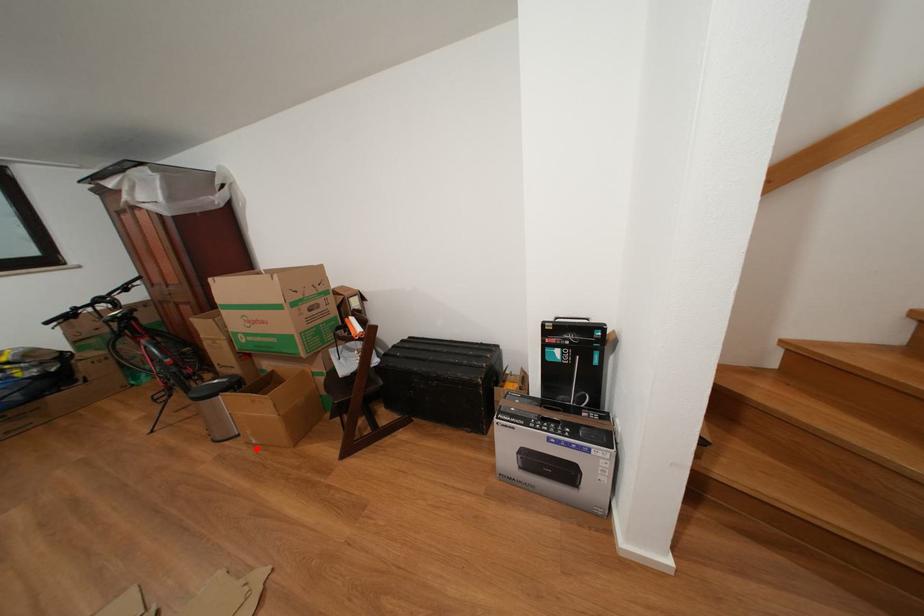
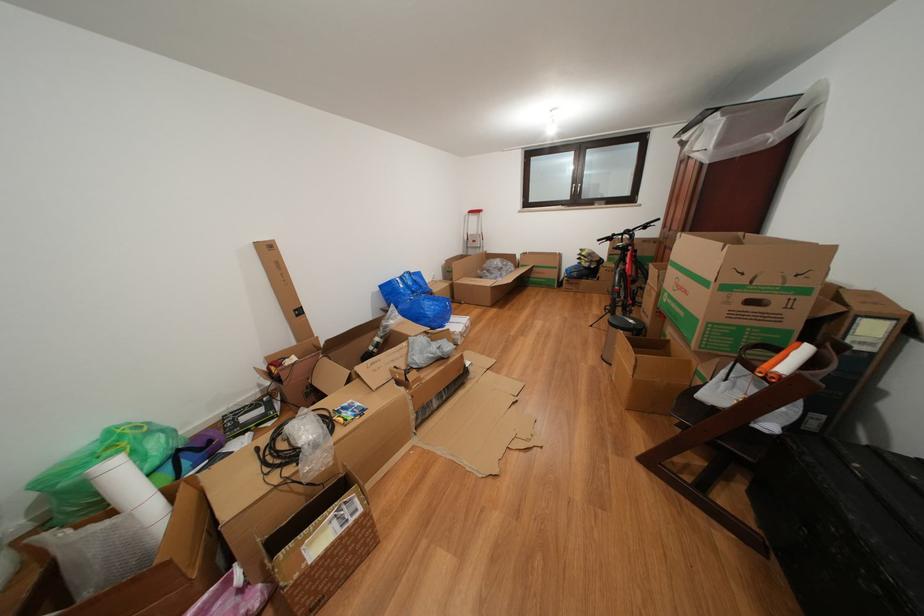
Question: I am providing you with two images of the same scene from different viewpoints. Given a red point in image1, look at the same physical point in image2. Is it:

Choices:
 (A) Closer to the viewpoint
 (B) Farther from the viewpoint

Answer: (A)